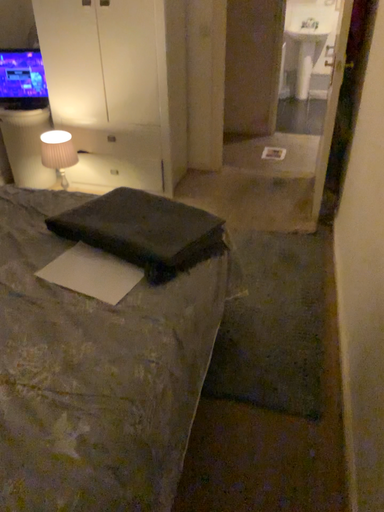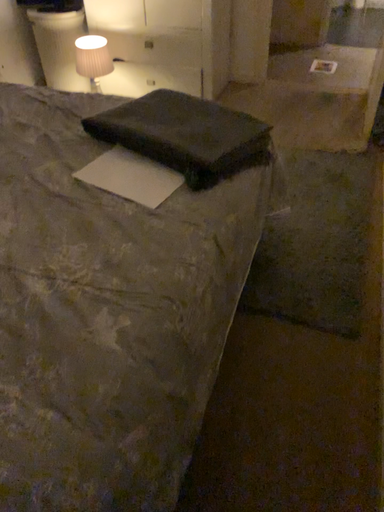
Question: How did the camera likely rotate when shooting the video?

Choices:
 (A) rotated downward
 (B) rotated upward

Answer: (A)